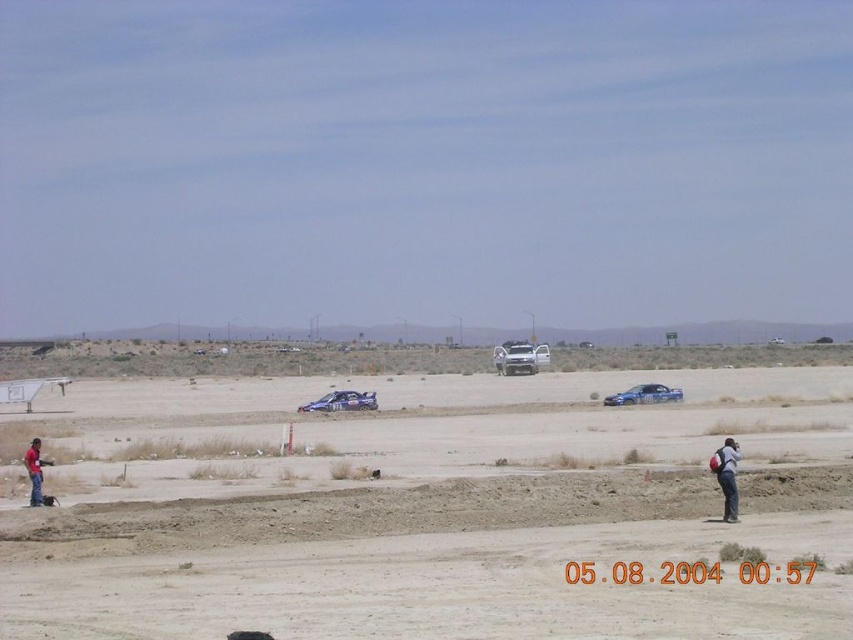
From the picture: Can you confirm if dull brown dirt at center is positioned to the right of metallic blue car at center?

Yes, dull brown dirt at center is to the right of metallic blue car at center.

Is dull brown dirt at center above metallic blue car at center?

Yes.

Between point (537, 554) and point (349, 410), which one is positioned behind?

Point (349, 410)

Where is `dull brown dirt at center`? The height and width of the screenshot is (640, 853). dull brown dirt at center is located at coordinates (456, 520).

Which is more to the right, dull brown dirt at center or blue metallic car at center?

From the viewer's perspective, blue metallic car at center appears more on the right side.

Which is in front, point (434, 563) or point (616, 396)?

Positioned in front is point (434, 563).

In order to click on dull brown dirt at center in this screenshot , I will do `click(456, 520)`.

Image resolution: width=853 pixels, height=640 pixels. What are the coordinates of `dull brown dirt at center` in the screenshot? It's located at (456, 520).

Who is more forward, (729, 508) or (355, 396)?

Point (729, 508) is more forward.

Is denim jacket at lower right smaller than metallic blue car at center?

Correct, denim jacket at lower right occupies less space than metallic blue car at center.

You are a GUI agent. You are given a task and a screenshot of the screen. Output one action in this format:
    pyautogui.click(x=<x>, y=<y>)
    Task: Click on the denim jacket at lower right
    
    Given the screenshot: What is the action you would take?
    pyautogui.click(x=727, y=476)